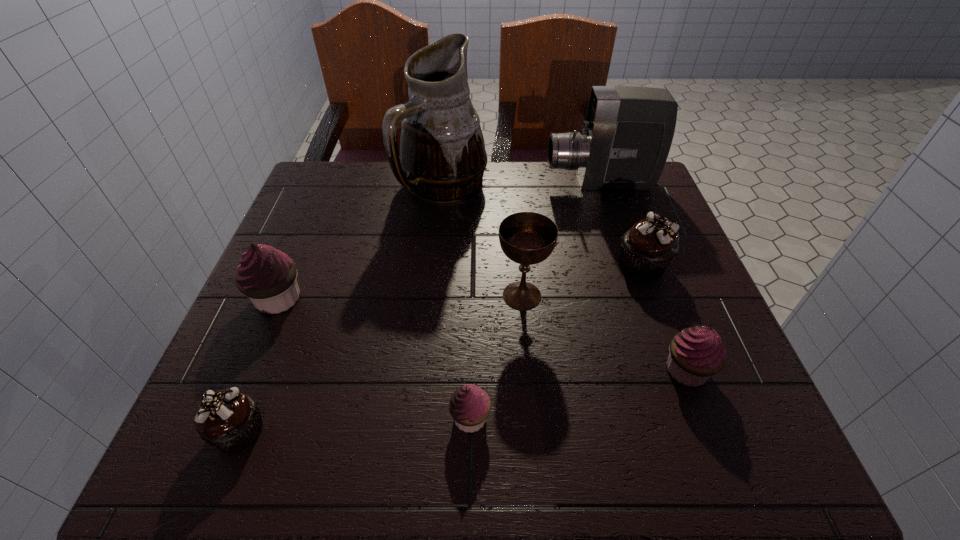
The image size is (960, 540). What are the coordinates of `vacant region at the near edge of the desktop` in the screenshot? It's located at (515, 436).

This screenshot has height=540, width=960. In order to click on vacant space at the left edge of the desktop in this screenshot , I will do `click(325, 275)`.

The height and width of the screenshot is (540, 960). What are the coordinates of `free region at the right edge of the desktop` in the screenshot? It's located at (679, 301).

Where is `vacant space at the far left corner of the desktop`? The width and height of the screenshot is (960, 540). vacant space at the far left corner of the desktop is located at coordinates (352, 194).

Where is `vacant space at the near left corner`? The image size is (960, 540). vacant space at the near left corner is located at coordinates (241, 468).

Where is `vacant region between the bigger brown cupcake and the chalice`? The image size is (960, 540). vacant region between the bigger brown cupcake and the chalice is located at coordinates (582, 280).

You are a GUI agent. You are given a task and a screenshot of the screen. Output one action in this format:
    pyautogui.click(x=<x>, y=<y>)
    Task: Click on the free area in between the fourth object from right to left and the third cupcake from right to left
    The height and width of the screenshot is (540, 960).
    Given the screenshot: What is the action you would take?
    pyautogui.click(x=496, y=356)

Identify the location of free space between the right brown cupcake and the nearer brown cupcake. Image resolution: width=960 pixels, height=540 pixels. (441, 348).

Find the location of a particular element. The height and width of the screenshot is (540, 960). free spot between the tallest object and the chalice is located at coordinates 483,241.

The width and height of the screenshot is (960, 540). Identify the location of empty location between the farthest pink cupcake and the camcorder. (439, 241).